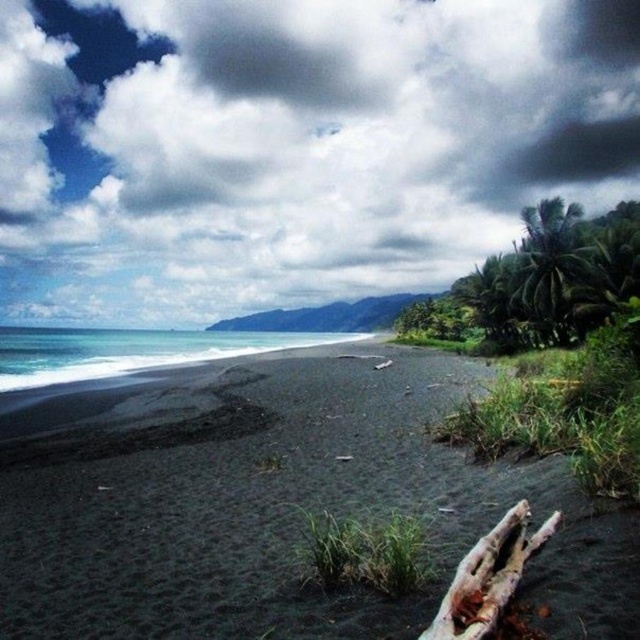
Question: Is cloudy sky at upper center to the right of black sand beach at center from the viewer's perspective?

Choices:
 (A) no
 (B) yes

Answer: (A)

Question: Among these points, which one is farthest from the camera?

Choices:
 (A) (508, 540)
 (B) (52, 632)
 (C) (408, 113)

Answer: (C)

Question: Which point is closer to the camera?

Choices:
 (A) (515, 22)
 (B) (474, 557)

Answer: (B)

Question: Which point appears closest to the camera in this image?

Choices:
 (A) (616, 96)
 (B) (163, 467)

Answer: (B)

Question: Is cloudy sky at upper center above black sand beach at center?

Choices:
 (A) no
 (B) yes

Answer: (B)

Question: Is cloudy sky at upper center smaller than black sand beach at center?

Choices:
 (A) yes
 (B) no

Answer: (B)